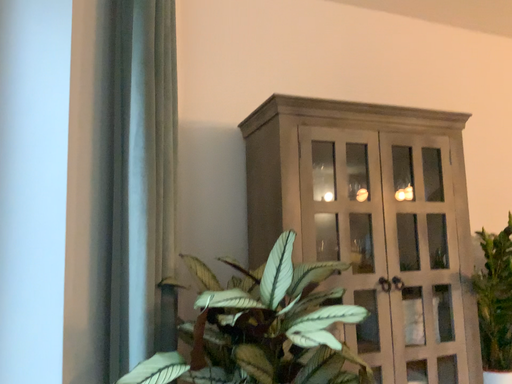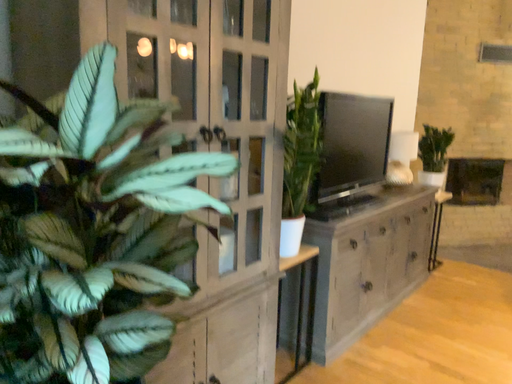
Question: Which way did the camera rotate in the video?

Choices:
 (A) rotated right
 (B) rotated left

Answer: (A)